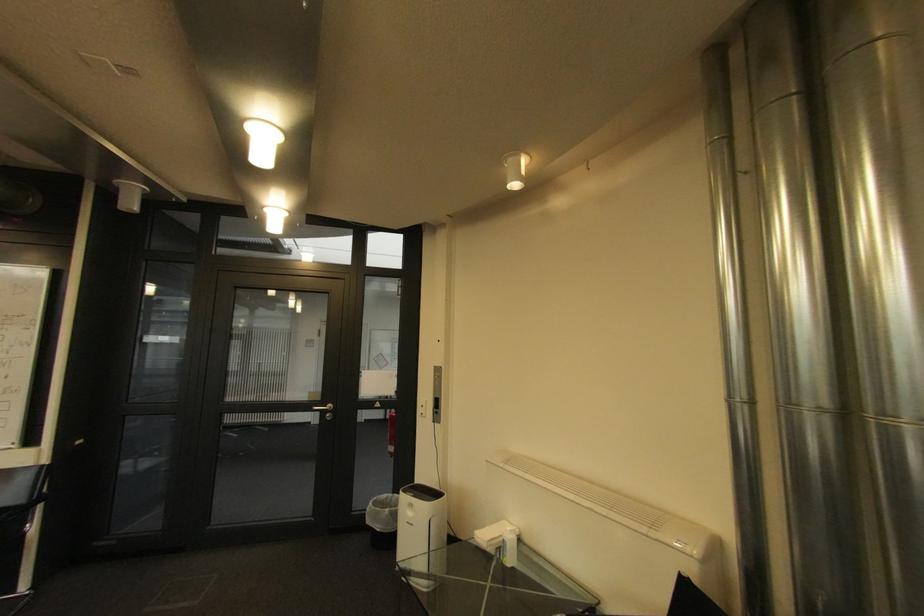
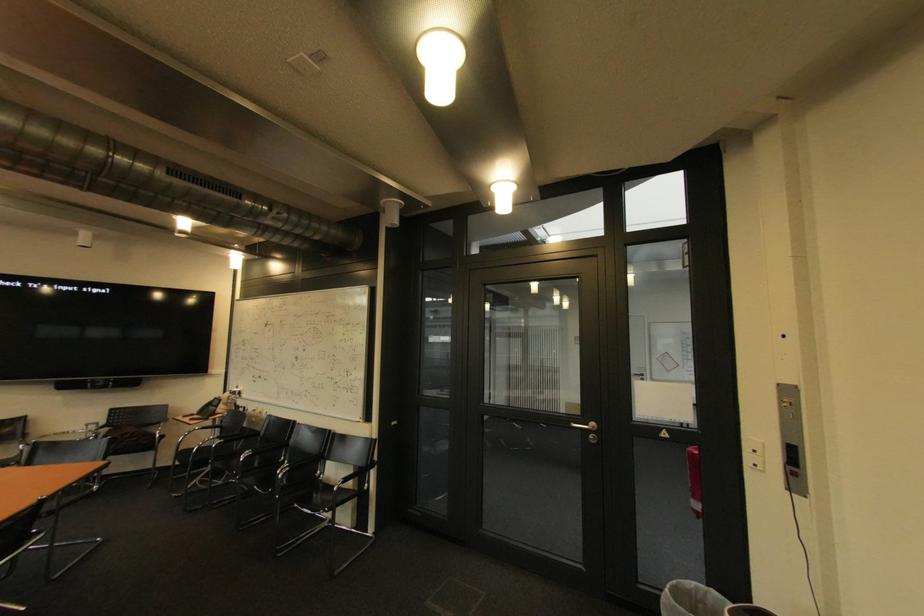
In the second image, find the point that corresponds to (x=334, y=408) in the first image.

(596, 426)